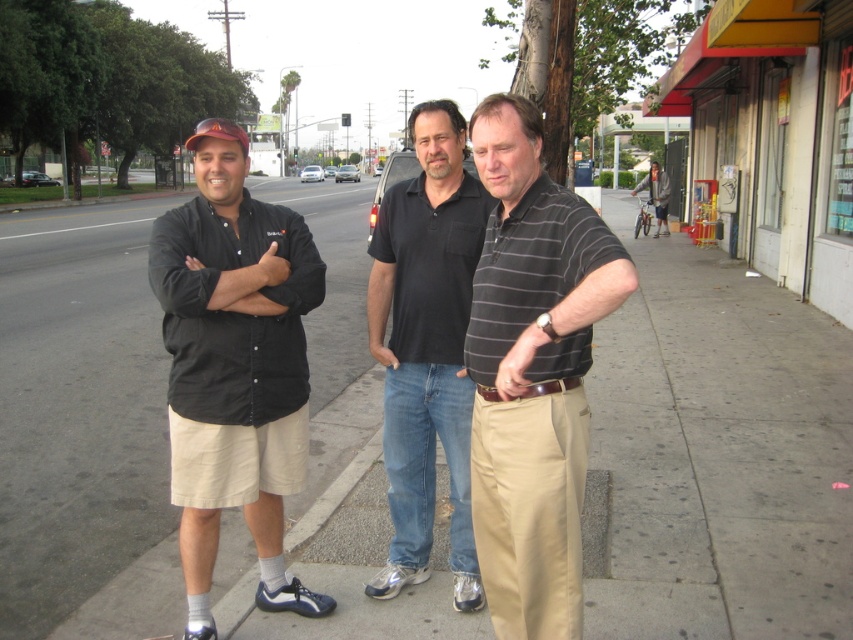
Question: Based on their relative distances, which object is nearer to the black cotton polo shirt at center?

Choices:
 (A) gray asphalt sidewalk at center
 (B) black cotton shirt at left
 (C) black striped shirt at center

Answer: (B)

Question: Can you confirm if black cotton polo shirt at center is wider than black matte shirt at left?

Choices:
 (A) no
 (B) yes

Answer: (B)

Question: Which object appears closest to the camera in this image?

Choices:
 (A) gray wool jacket at right
 (B) gray asphalt sidewalk at center
 (C) black smooth shirt at center
 (D) black striped shirt at center

Answer: (D)

Question: Is black smooth shirt at center wider than gray wool jacket at right?

Choices:
 (A) yes
 (B) no

Answer: (B)

Question: Which object is positioned closest to the gray wool jacket at right?

Choices:
 (A) black striped shirt at center
 (B) black matte shirt at center

Answer: (A)

Question: Can you confirm if khaki pants at center is positioned to the right of black matte shirt at left?

Choices:
 (A) no
 (B) yes

Answer: (B)